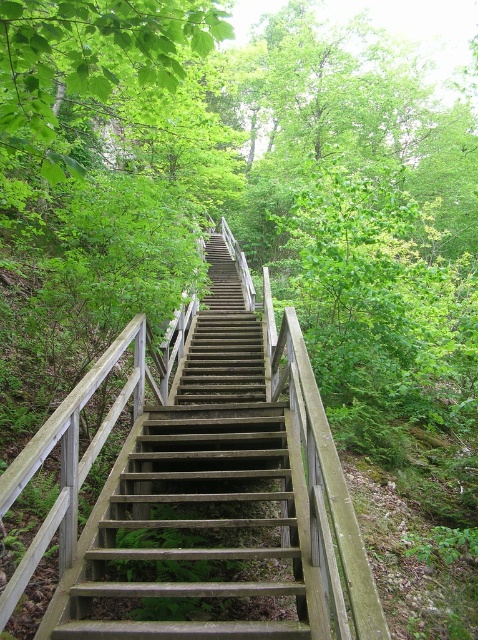
Measure the distance between point (239, 568) and camera.

Point (239, 568) is 13.53 feet from camera.

Between point (154, 566) and point (128, 4), which one is positioned in front?

Positioned in front is point (128, 4).

At what (x,y) coordinates should I click in order to perform the action: click on wooden stairs at center. Please return your answer as a coordinate pair (x, y). Looking at the image, I should click on (202, 502).